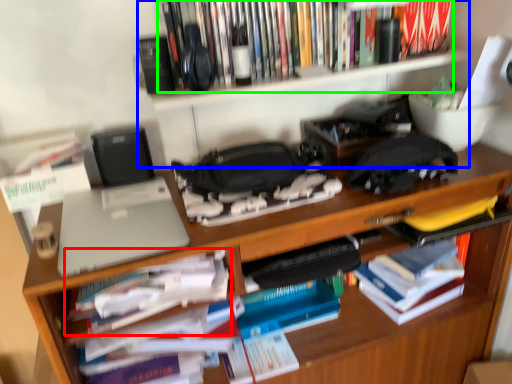
Question: Which is farther away from book (highlighted by a red box)? bookshelf (highlighted by a blue box) or book (highlighted by a green box)?

Choices:
 (A) bookshelf
 (B) book

Answer: (B)